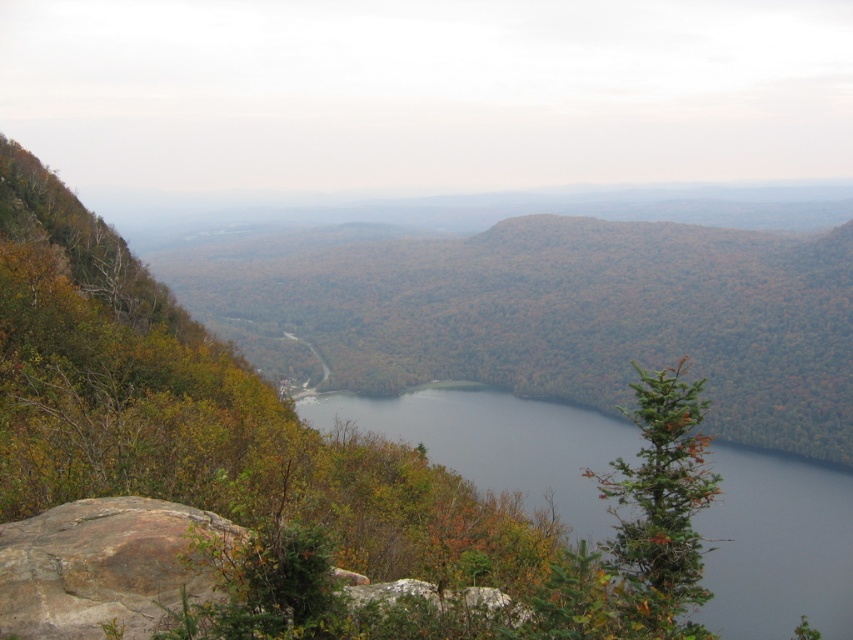
Question: Can you confirm if dark blue water at center is positioned to the right of brown rough rock at lower left?

Choices:
 (A) yes
 (B) no

Answer: (A)

Question: Can you confirm if dark blue water at center is smaller than brown rough rock at lower left?

Choices:
 (A) no
 (B) yes

Answer: (A)

Question: Can you confirm if dark blue water at center is bigger than brown rough rock at lower left?

Choices:
 (A) yes
 (B) no

Answer: (A)

Question: Which object appears farthest from the camera in this image?

Choices:
 (A) brown rough rock at lower left
 (B) dark blue water at center

Answer: (B)

Question: Which object appears closest to the camera in this image?

Choices:
 (A) dark blue water at center
 (B) brown rough rock at lower left

Answer: (B)